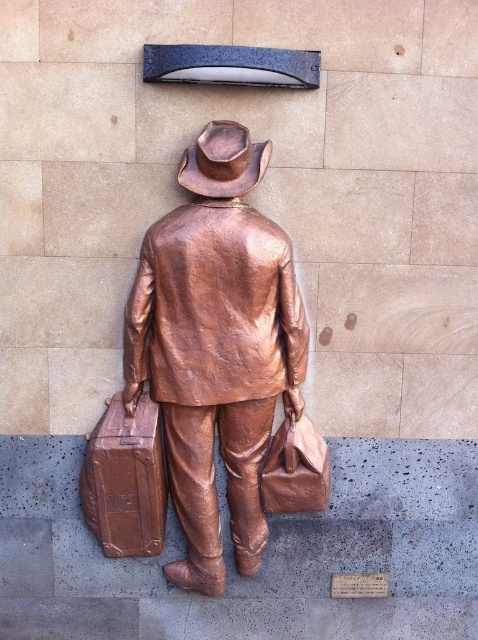
Which is below, bronze statue at center or bronze/copper cowboy hat at upper center?

bronze statue at center is lower down.

Can you confirm if bronze statue at center is positioned above bronze/copper cowboy hat at upper center?

No, bronze statue at center is not above bronze/copper cowboy hat at upper center.

Find the location of a particular element. bronze statue at center is located at coordinates (216, 346).

Image resolution: width=478 pixels, height=640 pixels. Identify the location of bronze statue at center. (216, 346).

Based on the photo, can you confirm if bronze statue at center is bigger than shiny brown suitcase at lower left?

Correct, bronze statue at center is larger in size than shiny brown suitcase at lower left.

Which of these two, bronze statue at center or shiny brown suitcase at lower left, stands shorter?

shiny brown suitcase at lower left is shorter.

The image size is (478, 640). What are the coordinates of `bronze statue at center` in the screenshot? It's located at (216, 346).

The width and height of the screenshot is (478, 640). I want to click on bronze statue at center, so click(216, 346).

Who is more distant from viewer, (x=141, y=436) or (x=249, y=184)?

The point (x=141, y=436) is behind.

Who is lower down, shiny brown suitcase at lower left or bronze/copper cowboy hat at upper center?

Positioned lower is shiny brown suitcase at lower left.

Which is behind, point (122, 541) or point (216, 161)?

Positioned behind is point (122, 541).

At what (x,y) coordinates should I click in order to perform the action: click on shiny brown suitcase at lower left. Please return your answer as a coordinate pair (x, y). Looking at the image, I should click on (126, 480).